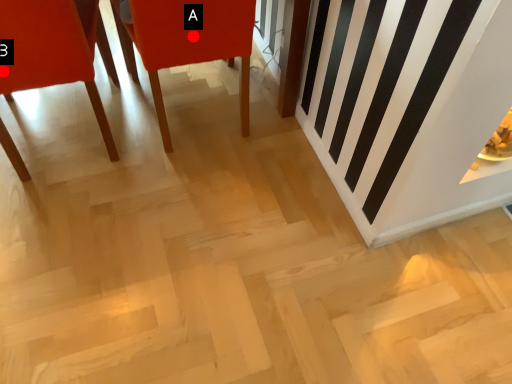
Question: Two points are circled on the image, labeled by A and B beside each circle. Which point is further to the camera?

Choices:
 (A) A is further
 (B) B is further

Answer: (A)